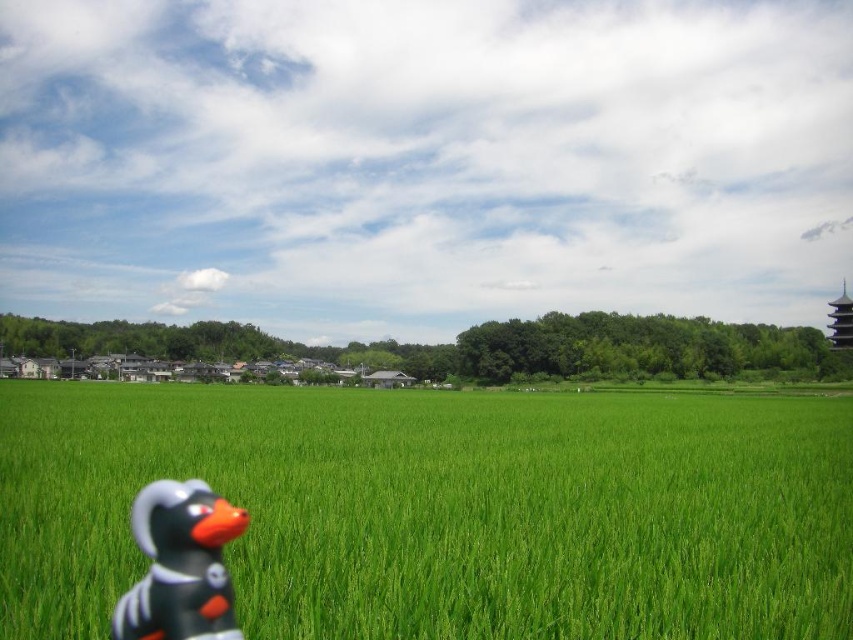
Does green grassy field at lower center appear on the right side of rubber duck at lower left?

No, green grassy field at lower center is not to the right of rubber duck at lower left.

Is green grassy field at lower center smaller than rubber duck at lower left?

Incorrect, green grassy field at lower center is not smaller in size than rubber duck at lower left.

Which is in front, point (543, 538) or point (167, 612)?

Point (167, 612)

In order to click on green grassy field at lower center in this screenshot , I will do `click(440, 509)`.